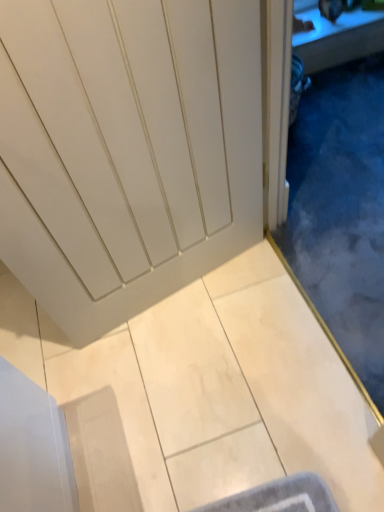
Locate an element on the screen. The width and height of the screenshot is (384, 512). vacant region above white matte door at center (from a real-world perspective) is located at coordinates (192, 384).